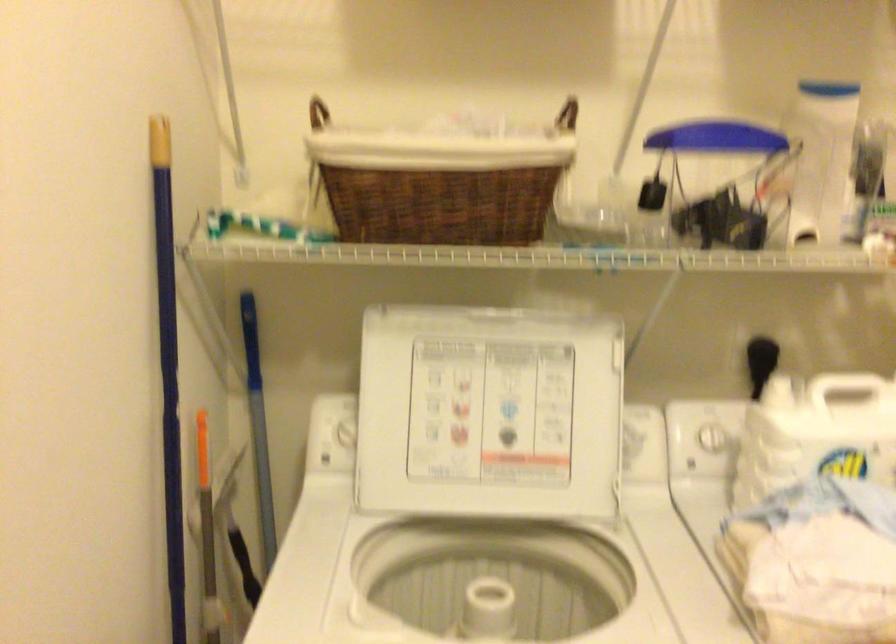
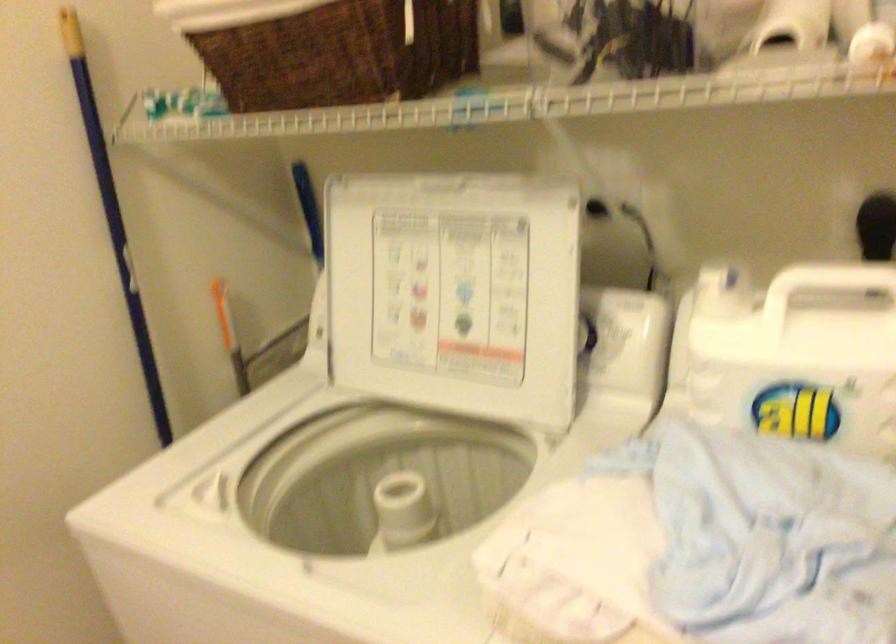
The point at (500,205) is marked in the first image. Where is the corresponding point in the second image?

(340, 53)